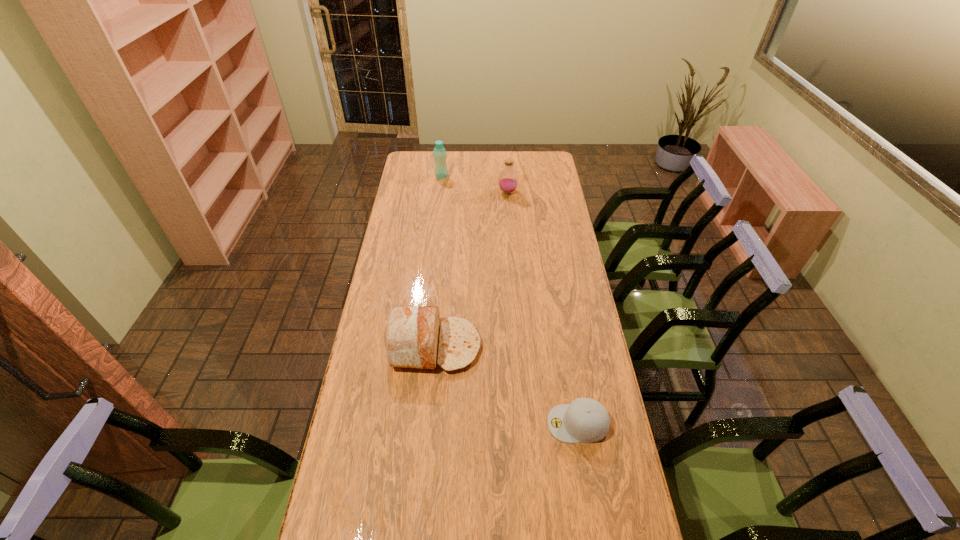
In the image, there is a desktop. Identify the location of vacant space at the far left corner. (406, 163).

Where is `free location at the far right corner of the desktop`? Image resolution: width=960 pixels, height=540 pixels. free location at the far right corner of the desktop is located at coordinates (553, 152).

Where is `free point between the shortest object and the nearer bottle`? free point between the shortest object and the nearer bottle is located at coordinates (542, 308).

Identify the location of free space between the cap and the nearer bottle. The height and width of the screenshot is (540, 960). (542, 308).

You are a GUI agent. You are given a task and a screenshot of the screen. Output one action in this format:
    pyautogui.click(x=<x>, y=<y>)
    Task: Click on the vacant region between the third nearest object and the farthest object
    The image size is (960, 540).
    Given the screenshot: What is the action you would take?
    pyautogui.click(x=474, y=184)

The image size is (960, 540). Find the location of `unoccupied position between the nearest object and the farthest object`. unoccupied position between the nearest object and the farthest object is located at coordinates (510, 300).

The height and width of the screenshot is (540, 960). What are the coordinates of `unoccupied position between the shortest object and the right bottle` in the screenshot? It's located at (542, 308).

Find the location of a particular element. The image size is (960, 540). free point between the rightmost object and the bread is located at coordinates (506, 384).

This screenshot has height=540, width=960. I want to click on vacant area between the rightmost object and the left bottle, so click(510, 300).

Where is `free point between the rightmost object and the second farthest object`? Image resolution: width=960 pixels, height=540 pixels. free point between the rightmost object and the second farthest object is located at coordinates (542, 308).